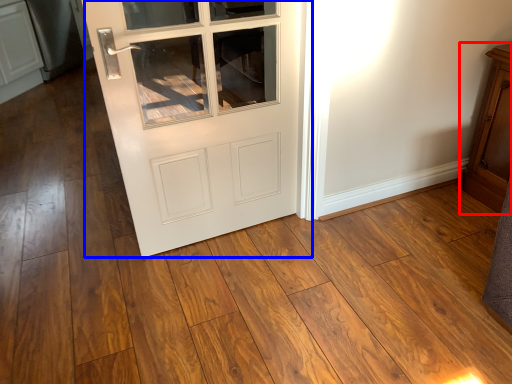
Question: Which point is closer to the camera, dresser (highlighted by a red box) or door (highlighted by a blue box)?

Choices:
 (A) dresser
 (B) door

Answer: (B)